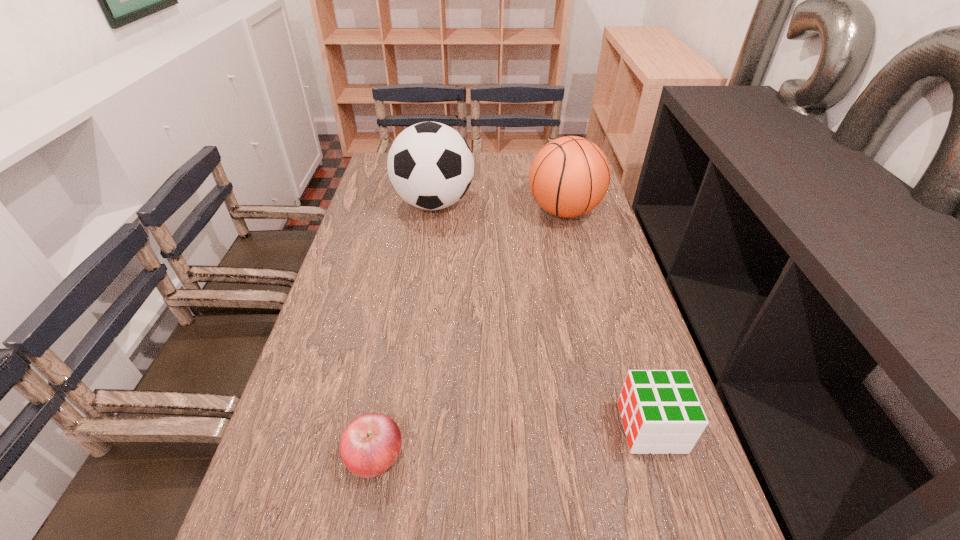
Locate an element on the screen. The image size is (960, 540). soccer ball is located at coordinates tap(430, 165).

Find the location of `basketball`. basketball is located at coordinates (569, 177).

The width and height of the screenshot is (960, 540). Find the location of `cube`. cube is located at coordinates (661, 413).

Image resolution: width=960 pixels, height=540 pixels. Identify the location of apple. (370, 444).

Where is `free space located on the front of the soccer ball`? Image resolution: width=960 pixels, height=540 pixels. free space located on the front of the soccer ball is located at coordinates (422, 282).

Where is `free location located 0.210m on the front of the basketball`? The height and width of the screenshot is (540, 960). free location located 0.210m on the front of the basketball is located at coordinates (581, 279).

Locate an element on the screen. free space located on the red face of the cube is located at coordinates (494, 427).

At what (x,y) coordinates should I click in order to perform the action: click on vacant space located on the red face of the cube. Please return your answer as a coordinate pair (x, y). This screenshot has width=960, height=540. Looking at the image, I should click on (549, 427).

Locate an element on the screen. free region located on the red face of the cube is located at coordinates (568, 427).

The height and width of the screenshot is (540, 960). I want to click on vacant region located 0.130m on the right of the apple, so click(471, 456).